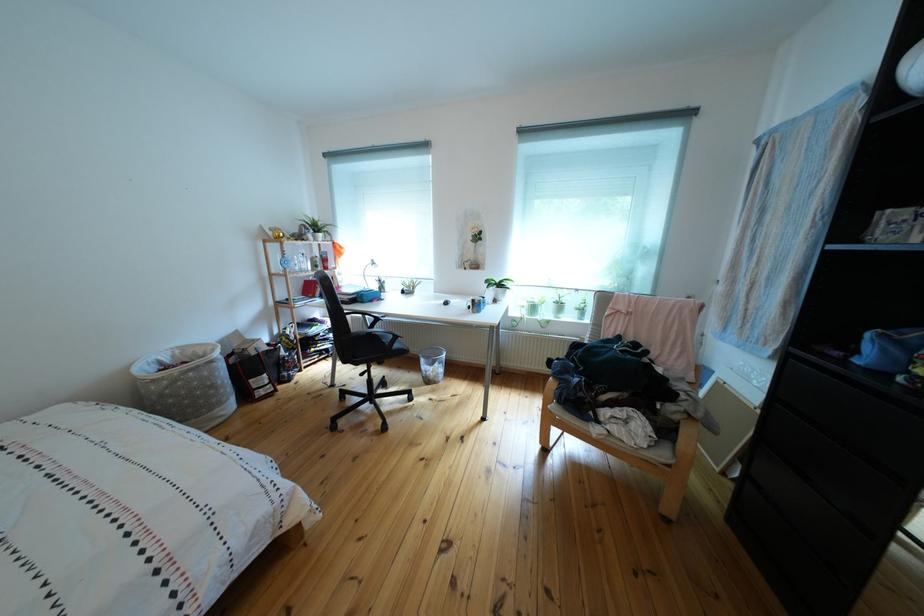
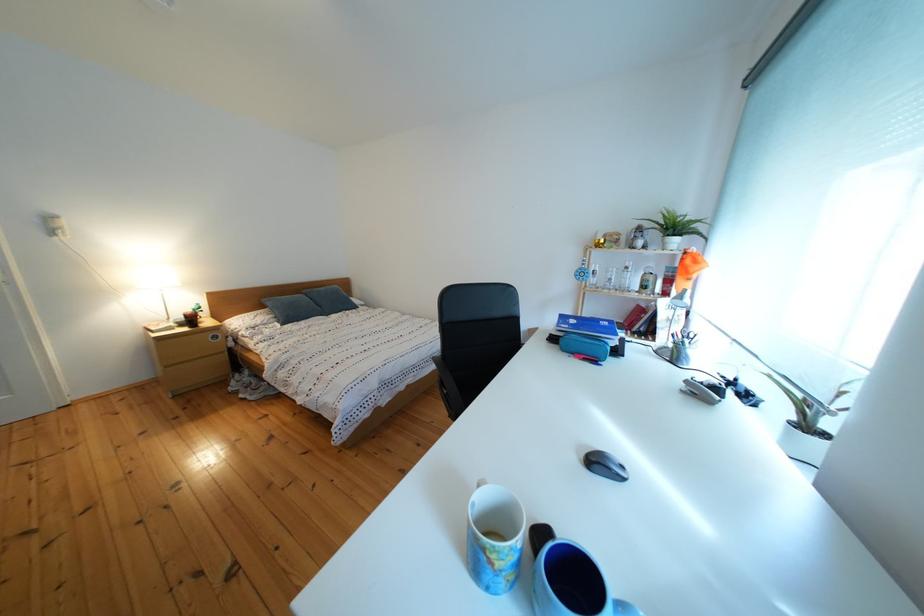
Find the pixel in the second image that matches (349,254) in the first image.

(699, 267)